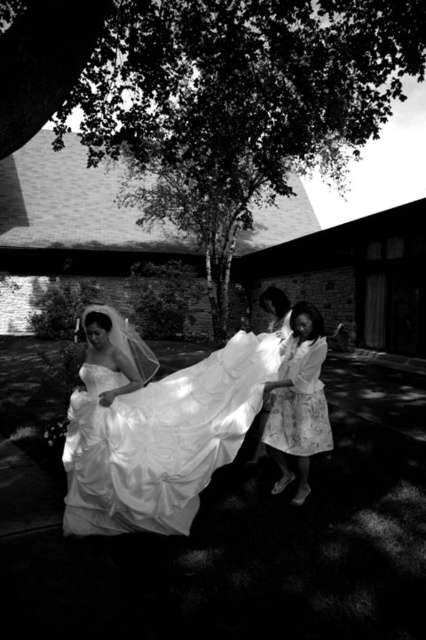
Does satin/sheer white dress at center appear on the right side of floral cotton dress at lower right?

In fact, satin/sheer white dress at center is to the left of floral cotton dress at lower right.

Find the location of a particular element. This screenshot has width=426, height=640. satin/sheer white dress at center is located at coordinates (161, 438).

Locate an element on the screen. satin/sheer white dress at center is located at coordinates (161, 438).